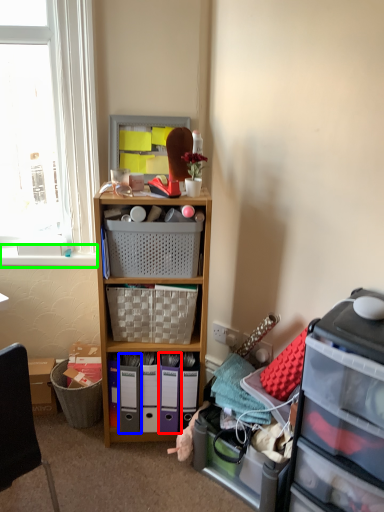
Question: Which object is positioned closest to bin (highlighted by a red box)? Select from bin (highlighted by a blue box) and window sill (highlighted by a green box).

Choices:
 (A) bin
 (B) window sill

Answer: (A)